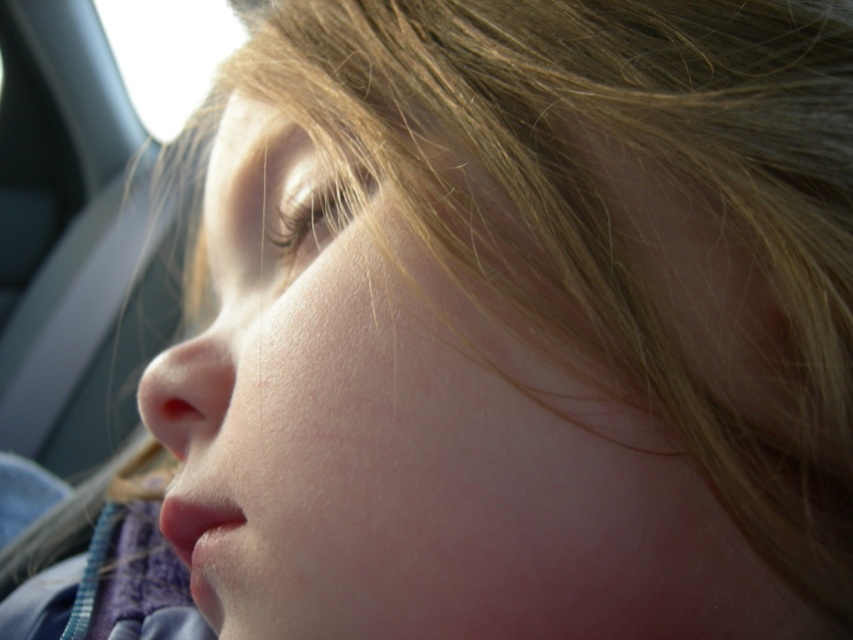
Who is lower down, transparent glass car window at upper left or smooth skin nose at center?

smooth skin nose at center is lower down.

Is transparent glass car window at upper left shorter than smooth skin nose at center?

Incorrect, transparent glass car window at upper left's height does not fall short of smooth skin nose at center's.

Is point (125, 76) more distant than point (146, 404)?

That is True.

Locate an element on the screen. The width and height of the screenshot is (853, 640). transparent glass car window at upper left is located at coordinates (167, 52).